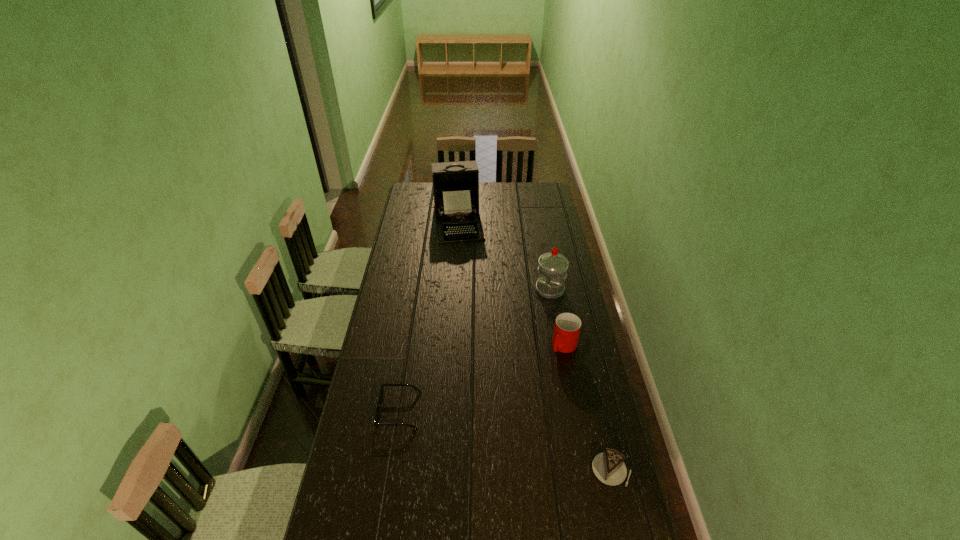
Where is `object that is at the far edge`? This screenshot has width=960, height=540. object that is at the far edge is located at coordinates (455, 184).

The width and height of the screenshot is (960, 540). Identify the location of object present at the left edge. (378, 409).

You are a GUI agent. You are given a task and a screenshot of the screen. Output one action in this format:
    pyautogui.click(x=<x>, y=<y>)
    Task: Click on the chocolate cake that is at the right edge
    The image size is (960, 540).
    Given the screenshot: What is the action you would take?
    [608, 467]

The width and height of the screenshot is (960, 540). Find the location of `cup situated at the right edge`. cup situated at the right edge is located at coordinates (567, 327).

This screenshot has width=960, height=540. Identify the location of water bottle present at the right edge. (552, 271).

Find the location of a particular element. This screenshot has height=540, width=960. vacant area at the far edge of the desktop is located at coordinates (512, 192).

The width and height of the screenshot is (960, 540). In the image, there is a desktop. What are the coordinates of `vacant space at the near edge` in the screenshot? It's located at (499, 531).

Image resolution: width=960 pixels, height=540 pixels. In order to click on vacant region at the left edge of the desktop in this screenshot , I will do coord(381,454).

Find the location of a particular element. blank space at the right edge is located at coordinates (591, 481).

Locate an element on the screen. This screenshot has height=540, width=960. vacant position at the far left corner of the desktop is located at coordinates (413, 200).